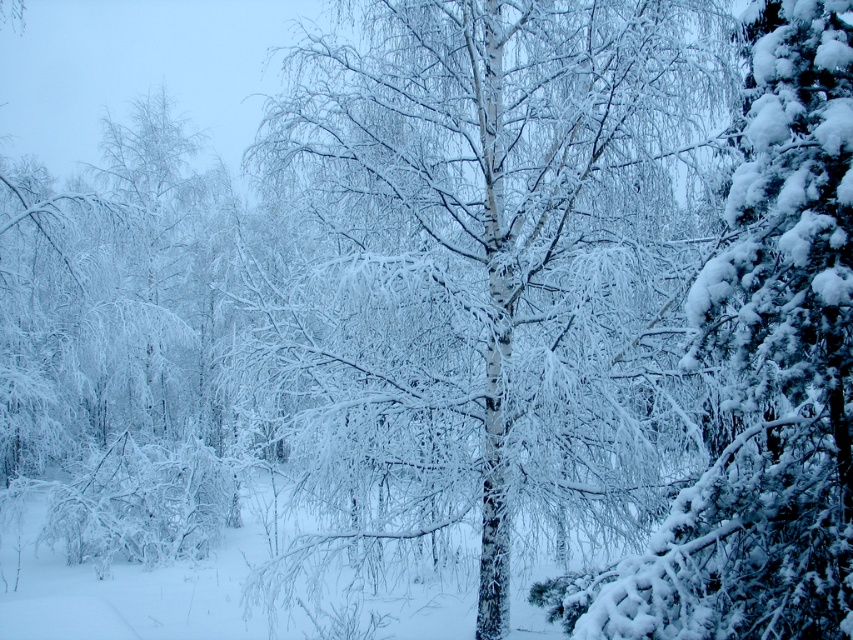
You are standing in a winter forest and want to take a photo of the white matte tree at center. If your camera has a maximum focus range of 6 meters, will it be able to focus on the tree?

The white matte tree at center is 6.30 meters away from the viewer. Since the camera can only focus up to 6 meters, it will not be able to focus on the tree.